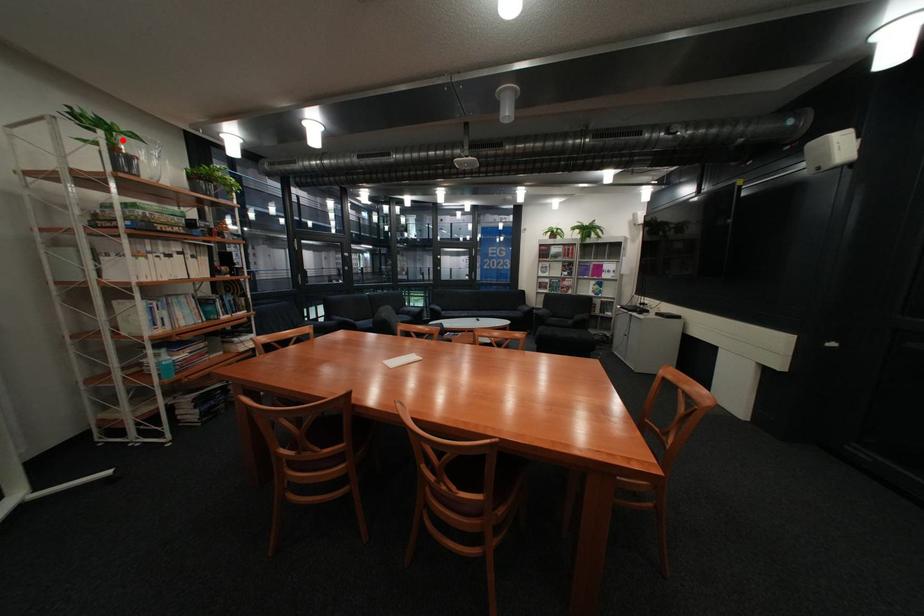
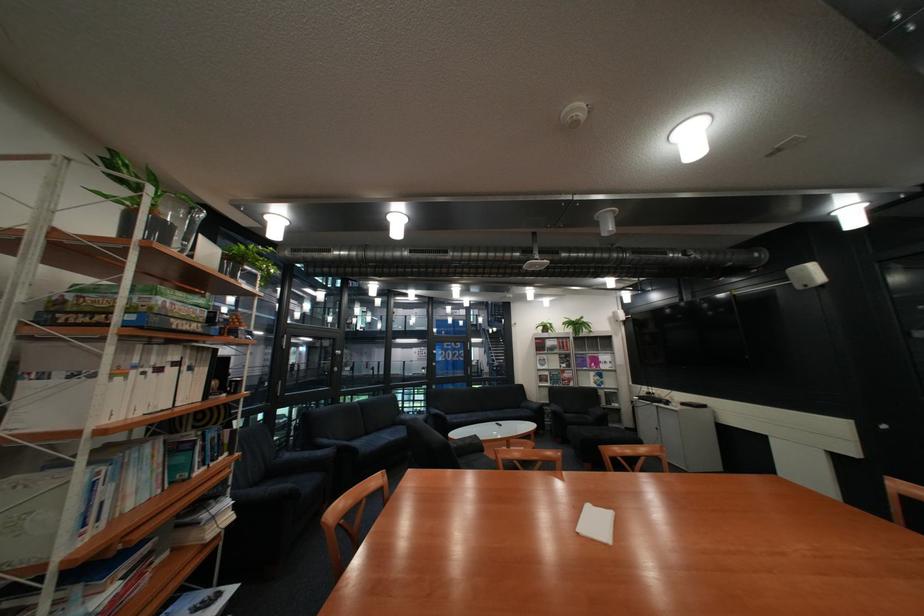
Locate, in the second image, the point that corresponds to the highlighted location in the first image.

(168, 199)